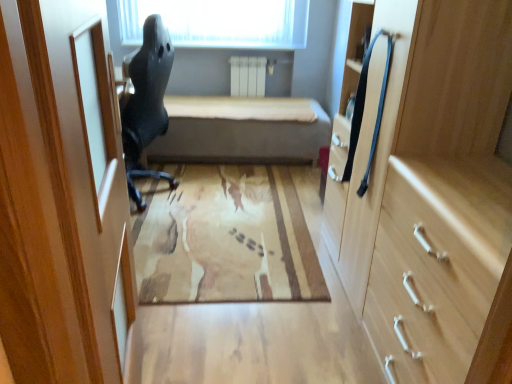
Question: Should I look upward or downward to see beige fabric bed at center?

Choices:
 (A) down
 (B) up

Answer: (B)

Question: From a real-world perspective, is beige fabric bed at center located higher than matte black chair at left?

Choices:
 (A) no
 (B) yes

Answer: (A)

Question: Does beige fabric bed at center lie behind matte black chair at left?

Choices:
 (A) no
 (B) yes

Answer: (B)

Question: From the image's perspective, is beige fabric bed at center below matte black chair at left?

Choices:
 (A) yes
 (B) no

Answer: (B)

Question: From the image's perspective, does beige fabric bed at center appear higher than matte black chair at left?

Choices:
 (A) no
 (B) yes

Answer: (B)

Question: Does beige fabric bed at center have a smaller size compared to matte black chair at left?

Choices:
 (A) no
 (B) yes

Answer: (A)

Question: Can you confirm if beige fabric bed at center is thinner than matte black chair at left?

Choices:
 (A) yes
 (B) no

Answer: (B)

Question: Considering the relative sizes of beige fabric bed at center and light wood cabinet at right in the image provided, is beige fabric bed at center bigger than light wood cabinet at right?

Choices:
 (A) no
 (B) yes

Answer: (B)

Question: Considering the relative sizes of beige fabric bed at center and light wood cabinet at right in the image provided, is beige fabric bed at center thinner than light wood cabinet at right?

Choices:
 (A) no
 (B) yes

Answer: (A)

Question: Is the position of beige fabric bed at center less distant than that of light wood cabinet at right?

Choices:
 (A) no
 (B) yes

Answer: (A)

Question: From the image's perspective, does beige fabric bed at center appear lower than light wood cabinet at right?

Choices:
 (A) no
 (B) yes

Answer: (A)

Question: Is beige fabric bed at center further to camera compared to light wood cabinet at right?

Choices:
 (A) yes
 (B) no

Answer: (A)

Question: Can you confirm if beige fabric bed at center is positioned to the right of light wood cabinet at right?

Choices:
 (A) no
 (B) yes

Answer: (A)

Question: From the image's perspective, is matte black chair at left on light wood drawer at right?

Choices:
 (A) no
 (B) yes

Answer: (B)